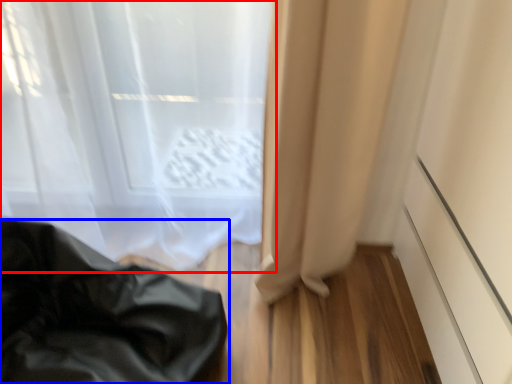
Question: Which of the following is the closest to the observer, curtain (highlighted by a red box) or furniture (highlighted by a blue box)?

Choices:
 (A) curtain
 (B) furniture

Answer: (B)